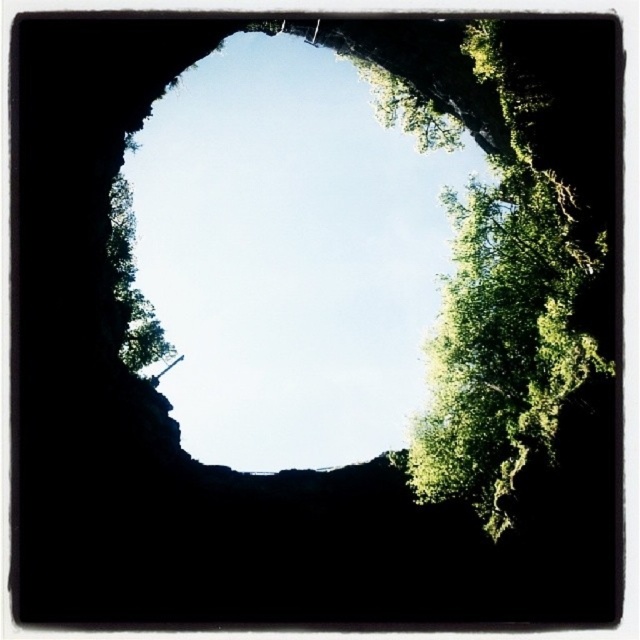
Can you confirm if green leafy tree at upper right is positioned to the left of green leafy tree at left?

Incorrect, green leafy tree at upper right is not on the left side of green leafy tree at left.

Does green leafy tree at upper right have a lesser width compared to green leafy tree at left?

No, green leafy tree at upper right is not thinner than green leafy tree at left.

Find the location of a particular element. green leafy tree at upper right is located at coordinates (504, 340).

I want to click on green leafy tree at upper right, so click(x=504, y=340).

Is transparent glass hole at center above green leafy tree at left?

Yes, transparent glass hole at center is above green leafy tree at left.

Can you confirm if transparent glass hole at center is bigger than green leafy tree at left?

Correct, transparent glass hole at center is larger in size than green leafy tree at left.

The width and height of the screenshot is (640, 640). What are the coordinates of `transparent glass hole at center` in the screenshot? It's located at (289, 248).

Can you confirm if transparent glass hole at center is smaller than green leafy tree at upper right?

No, transparent glass hole at center is not smaller than green leafy tree at upper right.

Who is more distant from viewer, (164, 118) or (502, 368)?

The point (164, 118) is more distant.

Locate an element on the screen. The height and width of the screenshot is (640, 640). transparent glass hole at center is located at coordinates (289, 248).